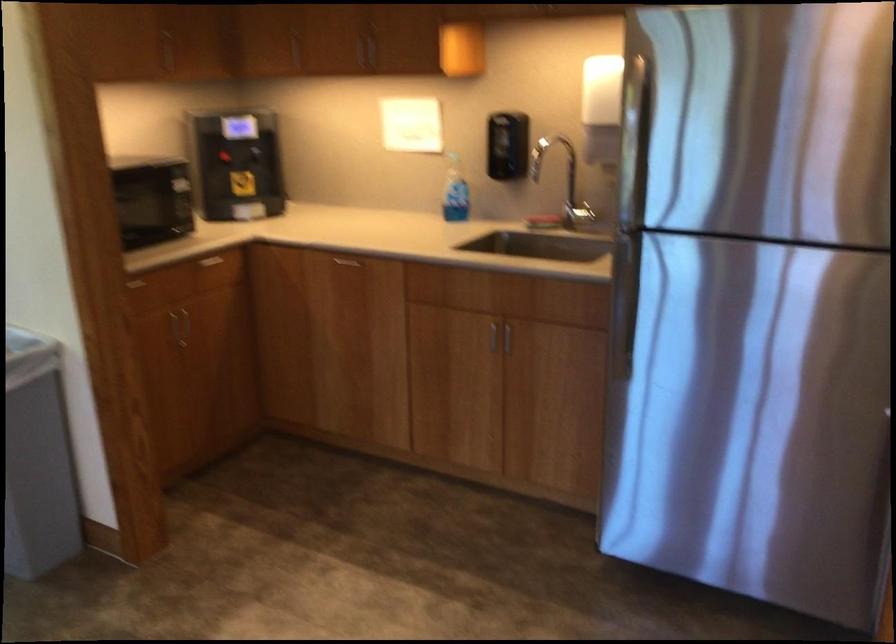
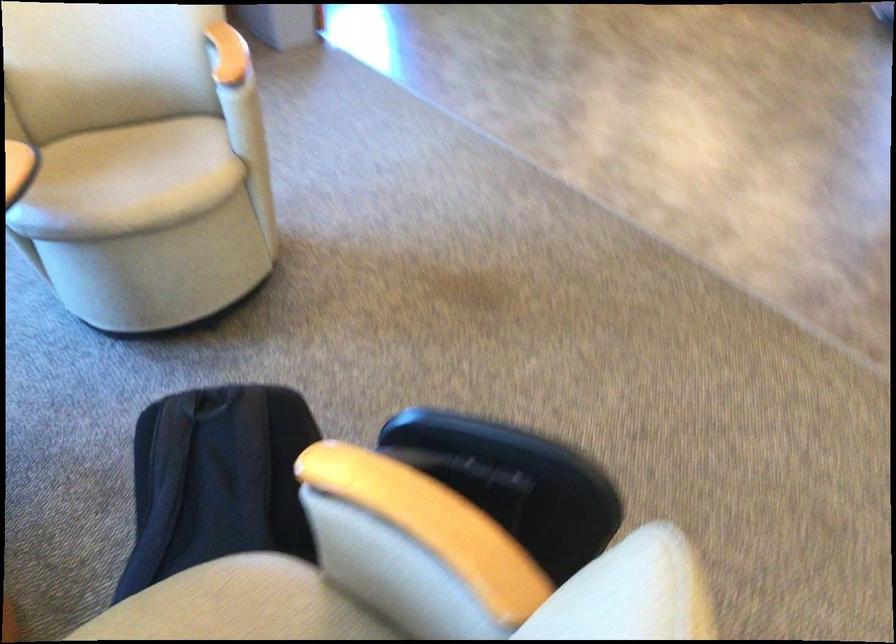
Question: In a continuous first-person perspective shot, in which direction is the camera moving?

Choices:
 (A) Left
 (B) Right
 (C) Forward
 (D) Backward

Answer: (D)